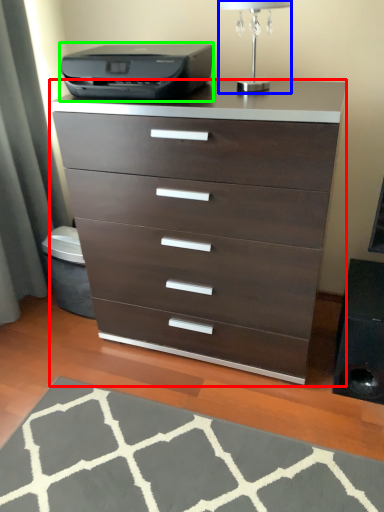
Question: Which object is positioned farthest from chest of drawers (highlighted by a red box)? Select from table lamp (highlighted by a blue box) and printer (highlighted by a green box).

Choices:
 (A) table lamp
 (B) printer

Answer: (A)